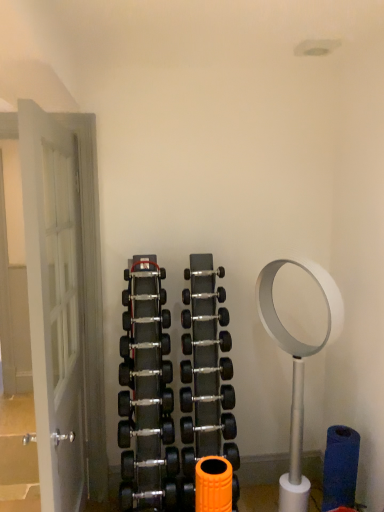
Image resolution: width=384 pixels, height=512 pixels. I want to click on polished silver dumbbell at center, placed as the fifth dumbbell when sorted from bottom to top, so click(x=144, y=373).

What is the approximate height of polished silver dumbbell at center, placed as the fifth dumbbell when sorted from bottom to top?

4.03 inches.

The height and width of the screenshot is (512, 384). What do you see at coordinates (207, 398) in the screenshot?
I see `polished silver dumbbell at center, arranged as the eighth dumbbell when viewed from the top` at bounding box center [207, 398].

Find the location of a particular element. This screenshot has height=512, width=384. black rubber dumbbell at center, which ranks as the first dumbbell in top-to-bottom order is located at coordinates (204, 273).

What do you see at coordinates (145, 432) in the screenshot? I see `black rubber dumbbell at center, which is the 1th dumbbell in bottom-to-top order` at bounding box center [145, 432].

This screenshot has width=384, height=512. What do you see at coordinates (145, 273) in the screenshot?
I see `black rubber dumbbell at center, arranged as the 2th dumbbell when viewed from the top` at bounding box center [145, 273].

I want to click on polished silver dumbbell at center, which ranks as the seventh dumbbell in top-to-bottom order, so click(x=144, y=373).

Consider the image. From the image's perspective, is black rubber dumbbell at center, the sixth dumbbell from the bottom, located above or below black rubber dumbbell at center, which is counted as the 2th dumbbell, starting from the bottom?

Clearly, from the image's perspective, black rubber dumbbell at center, the sixth dumbbell from the bottom, is above black rubber dumbbell at center, which is counted as the 2th dumbbell, starting from the bottom.

Is black rubber dumbbell at center, the 6th dumbbell viewed from the top, oriented towards black rubber dumbbell at center, which is counted as the 2th dumbbell, starting from the bottom?

No, black rubber dumbbell at center, the 6th dumbbell viewed from the top, is not turned towards black rubber dumbbell at center, which is counted as the 2th dumbbell, starting from the bottom.

How far apart are black rubber dumbbell at center, the sixth dumbbell from the bottom, and black rubber dumbbell at center, which appears as the 10th dumbbell when viewed from the top?

The distance of black rubber dumbbell at center, the sixth dumbbell from the bottom, from black rubber dumbbell at center, which appears as the 10th dumbbell when viewed from the top, is 16.88 inches.

Considering the positions of objects black rubber dumbbell at center, the sixth dumbbell from the bottom, and black rubber dumbbell at center, which is counted as the 2th dumbbell, starting from the bottom, in the image provided, who is more to the right, black rubber dumbbell at center, the sixth dumbbell from the bottom, or black rubber dumbbell at center, which is counted as the 2th dumbbell, starting from the bottom,?

black rubber dumbbell at center, which is counted as the 2th dumbbell, starting from the bottom, is more to the right.

Does white wooden door at left have a lesser height compared to silver metallic dumbbell at center, the 4th dumbbell from the top?

No, white wooden door at left is not shorter than silver metallic dumbbell at center, the 4th dumbbell from the top.

From a real-world perspective, between white wooden door at left and silver metallic dumbbell at center, the 8th dumbbell in the bottom-to-top sequence, who is vertically higher?

In real-world perspective, silver metallic dumbbell at center, the 8th dumbbell in the bottom-to-top sequence, is above.

Looking at this image, is white wooden door at left thinner than silver metallic dumbbell at center, the 4th dumbbell from the top?

Incorrect, the width of white wooden door at left is not less than that of silver metallic dumbbell at center, the 4th dumbbell from the top.

From a real-world perspective, which dumbbell is the 1st one above the white wooden door at left? Please provide its 2D coordinates.

[(204, 317)]

From the picture: Is black rubber dumbbell at center, the ninth dumbbell positioned from the bottom, surrounding black rubber dumbbell at center, which is counted as the 2th dumbbell, starting from the bottom?

Actually, black rubber dumbbell at center, which is counted as the 2th dumbbell, starting from the bottom, is outside black rubber dumbbell at center, the ninth dumbbell positioned from the bottom.

Find the location of `the 7th dumbbell directly above the black rubber dumbbell at center, which appears as the 10th dumbbell when viewed from the top (from a real-world perspective)`. the 7th dumbbell directly above the black rubber dumbbell at center, which appears as the 10th dumbbell when viewed from the top (from a real-world perspective) is located at coordinates (147, 319).

Does black rubber dumbbell at center, which appears as the 3th dumbbell when viewed from the top, appear on the left side of black rubber dumbbell at center, which is counted as the 2th dumbbell, starting from the bottom?

Indeed, black rubber dumbbell at center, which appears as the 3th dumbbell when viewed from the top, is positioned on the left side of black rubber dumbbell at center, which is counted as the 2th dumbbell, starting from the bottom.

From a real-world perspective, who is located higher, white wooden door at left or black rubber dumbbell at center, which is the tenth dumbbell in bottom-to-top order?

From a 3D spatial view, black rubber dumbbell at center, which is the tenth dumbbell in bottom-to-top order, is above.

Which of these two, white wooden door at left or black rubber dumbbell at center, which is the tenth dumbbell in bottom-to-top order, is bigger?

Bigger between the two is white wooden door at left.

How different are the orientations of white wooden door at left and black rubber dumbbell at center, which is the tenth dumbbell in bottom-to-top order, in degrees?

The angle between the facing direction of white wooden door at left and the facing direction of black rubber dumbbell at center, which is the tenth dumbbell in bottom-to-top order, is 91.3 degrees.

The height and width of the screenshot is (512, 384). In order to click on door that is below the black rubber dumbbell at center, which is the tenth dumbbell in bottom-to-top order (from the image's perspective) in this screenshot , I will do `click(55, 304)`.

Considering the relative sizes of black rubber dumbbell at center, the ninth dumbbell positioned from the bottom, and black rubber dumbbell at center, which is the 1th dumbbell in bottom-to-top order, in the image provided, is black rubber dumbbell at center, the ninth dumbbell positioned from the bottom, smaller than black rubber dumbbell at center, which is the 1th dumbbell in bottom-to-top order,?

Yes, black rubber dumbbell at center, the ninth dumbbell positioned from the bottom, is smaller than black rubber dumbbell at center, which is the 1th dumbbell in bottom-to-top order.

Is black rubber dumbbell at center, which appears as the 3th dumbbell when viewed from the top, in front of or behind black rubber dumbbell at center, which is the 1th dumbbell in bottom-to-top order, in the image?

black rubber dumbbell at center, which appears as the 3th dumbbell when viewed from the top, is behind black rubber dumbbell at center, which is the 1th dumbbell in bottom-to-top order.

From the image's perspective, is black rubber dumbbell at center, which appears as the 3th dumbbell when viewed from the top, located above or below black rubber dumbbell at center, which is the 1th dumbbell in bottom-to-top order?

black rubber dumbbell at center, which appears as the 3th dumbbell when viewed from the top, is above black rubber dumbbell at center, which is the 1th dumbbell in bottom-to-top order.

Is black rubber dumbbell at center, the ninth dumbbell positioned from the bottom, wider than black rubber dumbbell at center, which is the 1th dumbbell in bottom-to-top order?

Incorrect, the width of black rubber dumbbell at center, the ninth dumbbell positioned from the bottom, does not surpass that of black rubber dumbbell at center, which is the 1th dumbbell in bottom-to-top order.

Which is closer, (169, 403) or (157, 342)?

The point (157, 342) is in front.

Is black rubber dumbbell at center, the 6th dumbbell viewed from the top, surrounded by black rubber dumbbell at center, which is counted as the third dumbbell, starting from the bottom?

No, black rubber dumbbell at center, the 6th dumbbell viewed from the top, is not surrounded by black rubber dumbbell at center, which is counted as the third dumbbell, starting from the bottom.

From the image's perspective, is black rubber dumbbell at center, placed as the ninth dumbbell when sorted from top to bottom, over black rubber dumbbell at center, the sixth dumbbell from the bottom?

No.

Is black rubber dumbbell at center, which is counted as the third dumbbell, starting from the bottom, aimed at black rubber dumbbell at center, the 6th dumbbell viewed from the top?

No, black rubber dumbbell at center, which is counted as the third dumbbell, starting from the bottom, is not oriented towards black rubber dumbbell at center, the 6th dumbbell viewed from the top.

Which object is closer to the camera taking this photo, black rubber dumbbell at center, which is the 11th dumbbell from bottom to top, or black rubber dumbbell at center, which is the tenth dumbbell in bottom-to-top order?

Positioned in front is black rubber dumbbell at center, which is the tenth dumbbell in bottom-to-top order.

Considering the sizes of objects black rubber dumbbell at center, which ranks as the first dumbbell in top-to-bottom order, and black rubber dumbbell at center, arranged as the 2th dumbbell when viewed from the top, in the image provided, who is smaller, black rubber dumbbell at center, which ranks as the first dumbbell in top-to-bottom order, or black rubber dumbbell at center, arranged as the 2th dumbbell when viewed from the top,?

black rubber dumbbell at center, arranged as the 2th dumbbell when viewed from the top.

Does black rubber dumbbell at center, which ranks as the first dumbbell in top-to-bottom order, touch black rubber dumbbell at center, which is the tenth dumbbell in bottom-to-top order?

No, black rubber dumbbell at center, which ranks as the first dumbbell in top-to-bottom order, is not touching black rubber dumbbell at center, which is the tenth dumbbell in bottom-to-top order.

Considering the sizes of objects black rubber dumbbell at center, which ranks as the first dumbbell in top-to-bottom order, and black rubber dumbbell at center, arranged as the 2th dumbbell when viewed from the top, in the image provided, who is wider, black rubber dumbbell at center, which ranks as the first dumbbell in top-to-bottom order, or black rubber dumbbell at center, arranged as the 2th dumbbell when viewed from the top,?

Wider between the two is black rubber dumbbell at center, arranged as the 2th dumbbell when viewed from the top.

At what (x,y) coordinates should I click in order to perform the action: click on the 5th dumbbell directly beneath the black rubber dumbbell at center, the sixth dumbbell from the bottom (from a real-world perspective). Please return your answer as a coordinate pair (x, y). Image resolution: width=384 pixels, height=512 pixels. Looking at the image, I should click on (208, 428).

From the image's perspective, starting from the white wooden door at left, which dumbbell is the 3rd one above? Please provide its 2D coordinates.

[(204, 317)]

From the image, which object appears to be farther from white wooden door at left, black rubber dumbbell at center, placed as the ninth dumbbell when sorted from top to bottom, or black rubber dumbbell at center, which ranks as the first dumbbell in top-to-bottom order?

Based on the image, black rubber dumbbell at center, which ranks as the first dumbbell in top-to-bottom order, appears to be further to white wooden door at left.

Looking at the image, which one is located closer to black rubber dumbbell at center, the eleventh dumbbell in the top-to-bottom sequence, polished silver dumbbell at center, arranged as the eighth dumbbell when viewed from the top, or black rubber dumbbell at center, which appears as the 10th dumbbell when viewed from the top?

black rubber dumbbell at center, which appears as the 10th dumbbell when viewed from the top, lies closer to black rubber dumbbell at center, the eleventh dumbbell in the top-to-bottom sequence, than the other object.

Based on their spatial positions, is black rubber dumbbell at center, the ninth dumbbell positioned from the bottom, or polished silver dumbbell at center, placed as the fifth dumbbell when sorted from bottom to top, closer to black rubber dumbbell at center, arranged as the 2th dumbbell when viewed from the top?

Among the two, black rubber dumbbell at center, the ninth dumbbell positioned from the bottom, is located nearer to black rubber dumbbell at center, arranged as the 2th dumbbell when viewed from the top.

Estimate the real-world distances between objects in this image. Which object is closer to black rubber dumbbell at center, which appears as the 10th dumbbell when viewed from the top, white wooden door at left or black rubber dumbbell at center, which ranks as the first dumbbell in top-to-bottom order?

The object closer to black rubber dumbbell at center, which appears as the 10th dumbbell when viewed from the top, is black rubber dumbbell at center, which ranks as the first dumbbell in top-to-bottom order.

Looking at the image, which one is located further to white wooden door at left, black rubber dumbbell at center, which is counted as the 2th dumbbell, starting from the bottom, or black rubber dumbbell at center, the seventh dumbbell positioned from the bottom?

black rubber dumbbell at center, which is counted as the 2th dumbbell, starting from the bottom.

Looking at the image, which one is located further to black rubber dumbbell at center, the ninth dumbbell positioned from the bottom, black rubber dumbbell at center, the sixth dumbbell from the bottom, or black rubber dumbbell at center, which is the 11th dumbbell from bottom to top?

Based on the image, black rubber dumbbell at center, which is the 11th dumbbell from bottom to top, appears to be further to black rubber dumbbell at center, the ninth dumbbell positioned from the bottom.

Based on their spatial positions, is black rubber dumbbell at center, placed as the ninth dumbbell when sorted from top to bottom, or polished silver dumbbell at center, which ranks as the seventh dumbbell in top-to-bottom order, further from black rubber dumbbell at center, the 6th dumbbell viewed from the top?

black rubber dumbbell at center, placed as the ninth dumbbell when sorted from top to bottom, lies further to black rubber dumbbell at center, the 6th dumbbell viewed from the top, than the other object.

Based on the photo, looking at the image, which one is located further to silver metallic dumbbell at center, the 8th dumbbell in the bottom-to-top sequence, black rubber dumbbell at center, which appears as the 3th dumbbell when viewed from the top, or black rubber dumbbell at center, the seventh dumbbell positioned from the bottom?

Among the two, black rubber dumbbell at center, which appears as the 3th dumbbell when viewed from the top, is located further to silver metallic dumbbell at center, the 8th dumbbell in the bottom-to-top sequence.

The height and width of the screenshot is (512, 384). Find the location of `door between black rubber dumbbell at center, arranged as the 2th dumbbell when viewed from the top, and black rubber dumbbell at center, the eleventh dumbbell in the top-to-bottom sequence, from top to bottom`. door between black rubber dumbbell at center, arranged as the 2th dumbbell when viewed from the top, and black rubber dumbbell at center, the eleventh dumbbell in the top-to-bottom sequence, from top to bottom is located at coordinates (55, 304).

The image size is (384, 512). Identify the location of dumbbell situated between black rubber dumbbell at center, the ninth dumbbell positioned from the bottom, and silver metallic dumbbell at center, the 8th dumbbell in the bottom-to-top sequence, from left to right. (204, 273).

The image size is (384, 512). Identify the location of dumbbell between white wooden door at left and black rubber dumbbell at center, which is counted as the third dumbbell, starting from the bottom, along the z-axis. (145, 432).